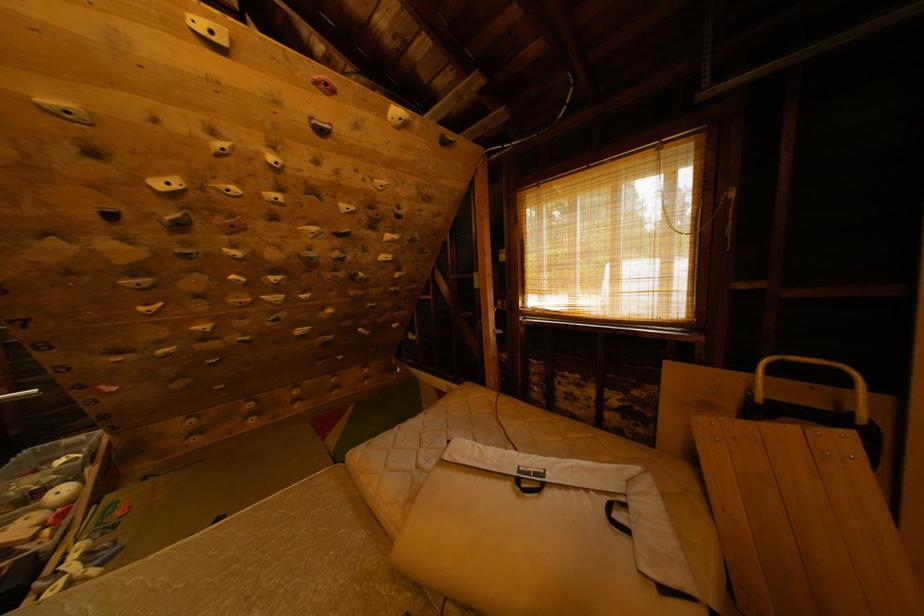
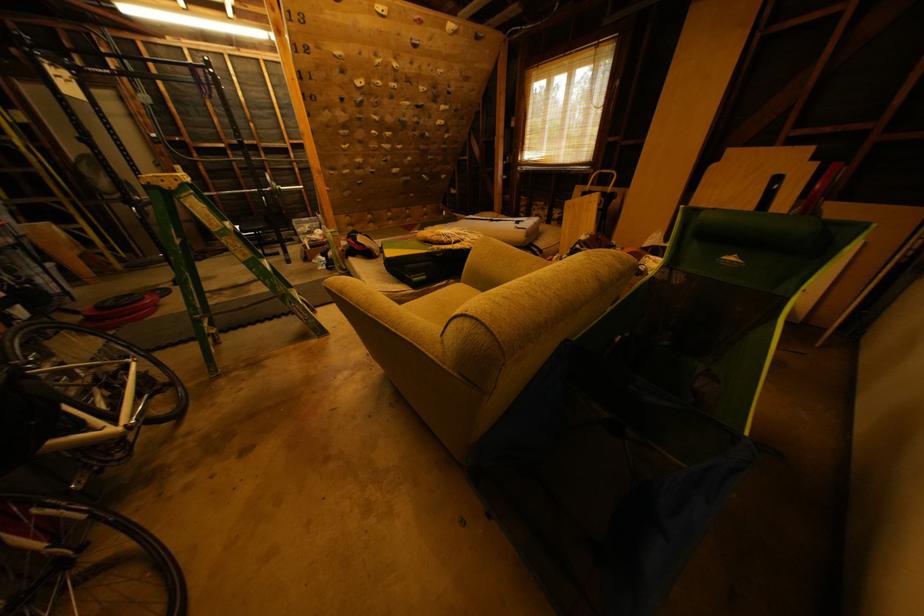
Question: The images are taken continuously from a first-person perspective. In which direction are you moving?

Choices:
 (A) Left
 (B) Right
 (C) Forward
 (D) Backward

Answer: (D)